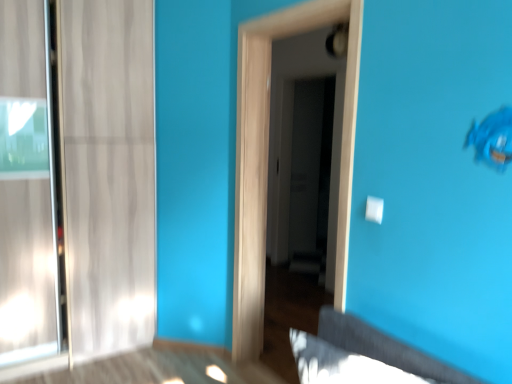
Consider the image. In order to face transparent glass door at center, positioned as the 2th screen door in front-to-back order, should I rotate leftwards or rightwards?

Rotate your view right by about 6.847°.

The image size is (512, 384). What are the coordinates of `transparent glass door at center, which is counted as the 1th screen door, starting from the back` in the screenshot? It's located at (311, 174).

The height and width of the screenshot is (384, 512). Describe the element at coordinates (311, 174) in the screenshot. I see `transparent glass door at center, positioned as the 2th screen door in front-to-back order` at that location.

Image resolution: width=512 pixels, height=384 pixels. Describe the element at coordinates (267, 158) in the screenshot. I see `transparent glass door at center, which is the 1th screen door from front to back` at that location.

In order to click on transparent glass door at center, the second screen door positioned from the back in this screenshot , I will do `click(267, 158)`.

Identify the location of transparent glass door at center, positioned as the 2th screen door in front-to-back order. pyautogui.click(x=311, y=174).

Is transparent glass door at center, the second screen door positioned from the back, at the left side of transparent glass door at center, which is counted as the 1th screen door, starting from the back?

Yes, transparent glass door at center, the second screen door positioned from the back, is to the left of transparent glass door at center, which is counted as the 1th screen door, starting from the back.

Is the depth of transparent glass door at center, the second screen door positioned from the back, less than that of transparent glass door at center, positioned as the 2th screen door in front-to-back order?

Yes.

Which point is more forward, (348, 107) or (302, 247)?

Point (348, 107)

From the image's perspective, is transparent glass door at center, the second screen door positioned from the back, positioned above or below transparent glass door at center, which is counted as the 1th screen door, starting from the back?

Clearly, from the image's perspective, transparent glass door at center, the second screen door positioned from the back, is below transparent glass door at center, which is counted as the 1th screen door, starting from the back.

From a real-world perspective, is transparent glass door at center, which is the 1th screen door from front to back, located beneath transparent glass door at center, which is counted as the 1th screen door, starting from the back?

Yes, from a real-world perspective, transparent glass door at center, which is the 1th screen door from front to back, is beneath transparent glass door at center, which is counted as the 1th screen door, starting from the back.

Which of these two, transparent glass door at center, which is the 1th screen door from front to back, or transparent glass door at center, which is counted as the 1th screen door, starting from the back, is wider?

transparent glass door at center, which is the 1th screen door from front to back, is wider.

Looking at this image, considering the sizes of objects transparent glass door at center, which is the 1th screen door from front to back, and transparent glass door at center, positioned as the 2th screen door in front-to-back order, in the image provided, who is shorter, transparent glass door at center, which is the 1th screen door from front to back, or transparent glass door at center, positioned as the 2th screen door in front-to-back order,?

transparent glass door at center, positioned as the 2th screen door in front-to-back order.

From the picture: Considering the sizes of transparent glass door at center, the second screen door positioned from the back, and transparent glass door at center, positioned as the 2th screen door in front-to-back order, in the image, is transparent glass door at center, the second screen door positioned from the back, bigger or smaller than transparent glass door at center, positioned as the 2th screen door in front-to-back order,?

transparent glass door at center, the second screen door positioned from the back, is bigger than transparent glass door at center, positioned as the 2th screen door in front-to-back order.

From the picture: Which is correct: transparent glass door at center, the second screen door positioned from the back, is inside transparent glass door at center, which is counted as the 1th screen door, starting from the back, or outside of it?

transparent glass door at center, the second screen door positioned from the back, is located beyond the bounds of transparent glass door at center, which is counted as the 1th screen door, starting from the back.

Is transparent glass door at center, which is the 1th screen door from front to back, next to transparent glass door at center, positioned as the 2th screen door in front-to-back order?

No, transparent glass door at center, which is the 1th screen door from front to back, is not in contact with transparent glass door at center, positioned as the 2th screen door in front-to-back order.

Is transparent glass door at center, which is counted as the 1th screen door, starting from the back, at the back of transparent glass door at center, the second screen door positioned from the back?

That's not correct — transparent glass door at center, the second screen door positioned from the back, is not looking away from transparent glass door at center, which is counted as the 1th screen door, starting from the back.

The height and width of the screenshot is (384, 512). Find the location of `screen door on the right side of transparent glass door at center, the second screen door positioned from the back`. screen door on the right side of transparent glass door at center, the second screen door positioned from the back is located at coordinates (311, 174).

Is transparent glass door at center, which is counted as the 1th screen door, starting from the back, to the left or to the right of transparent glass door at center, the second screen door positioned from the back, in the image?

Based on their positions, transparent glass door at center, which is counted as the 1th screen door, starting from the back, is located to the right of transparent glass door at center, the second screen door positioned from the back.

Between transparent glass door at center, which is counted as the 1th screen door, starting from the back, and transparent glass door at center, which is the 1th screen door from front to back, which one is positioned in front?

Positioned in front is transparent glass door at center, which is the 1th screen door from front to back.

Between point (321, 155) and point (347, 159), which one is positioned in front?

The point (347, 159) is more forward.

From the image's perspective, is transparent glass door at center, positioned as the 2th screen door in front-to-back order, located above transparent glass door at center, which is the 1th screen door from front to back?

Yes, from the image's perspective, transparent glass door at center, positioned as the 2th screen door in front-to-back order, is over transparent glass door at center, which is the 1th screen door from front to back.

From a real-world perspective, between transparent glass door at center, positioned as the 2th screen door in front-to-back order, and transparent glass door at center, the second screen door positioned from the back, who is vertically higher?

transparent glass door at center, positioned as the 2th screen door in front-to-back order, is physically above.

Considering the sizes of transparent glass door at center, which is counted as the 1th screen door, starting from the back, and transparent glass door at center, which is the 1th screen door from front to back, in the image, is transparent glass door at center, which is counted as the 1th screen door, starting from the back, wider or thinner than transparent glass door at center, which is the 1th screen door from front to back,?

In the image, transparent glass door at center, which is counted as the 1th screen door, starting from the back, appears to be more narrow than transparent glass door at center, which is the 1th screen door from front to back.

Considering the relative sizes of transparent glass door at center, positioned as the 2th screen door in front-to-back order, and transparent glass door at center, which is the 1th screen door from front to back, in the image provided, is transparent glass door at center, positioned as the 2th screen door in front-to-back order, shorter than transparent glass door at center, which is the 1th screen door from front to back,?

Yes, transparent glass door at center, positioned as the 2th screen door in front-to-back order, is shorter than transparent glass door at center, which is the 1th screen door from front to back.

Looking at this image, does transparent glass door at center, which is counted as the 1th screen door, starting from the back, have a larger size compared to transparent glass door at center, which is the 1th screen door from front to back?

Actually, transparent glass door at center, which is counted as the 1th screen door, starting from the back, might be smaller than transparent glass door at center, which is the 1th screen door from front to back.

Is transparent glass door at center, the second screen door positioned from the back, located within transparent glass door at center, positioned as the 2th screen door in front-to-back order?

That's incorrect, transparent glass door at center, the second screen door positioned from the back, is not inside transparent glass door at center, positioned as the 2th screen door in front-to-back order.

Is transparent glass door at center, positioned as the 2th screen door in front-to-back order, with transparent glass door at center, which is the 1th screen door from front to back?

No, transparent glass door at center, positioned as the 2th screen door in front-to-back order, is not next to transparent glass door at center, which is the 1th screen door from front to back.

Is transparent glass door at center, positioned as the 2th screen door in front-to-back order, looking in the opposite direction of transparent glass door at center, which is the 1th screen door from front to back?

No, transparent glass door at center, positioned as the 2th screen door in front-to-back order, is not facing away from transparent glass door at center, which is the 1th screen door from front to back.

How distant is transparent glass door at center, positioned as the 2th screen door in front-to-back order, from transparent glass door at center, the second screen door positioned from the back?

A distance of 6.35 feet exists between transparent glass door at center, positioned as the 2th screen door in front-to-back order, and transparent glass door at center, the second screen door positioned from the back.

Where is `screen door above the transparent glass door at center, the second screen door positioned from the back (from a real-world perspective)`? screen door above the transparent glass door at center, the second screen door positioned from the back (from a real-world perspective) is located at coordinates (311, 174).

At what (x,y) coordinates should I click in order to perform the action: click on screen door on the right of transparent glass door at center, which is the 1th screen door from front to back. Please return your answer as a coordinate pair (x, y). Looking at the image, I should click on (311, 174).

Image resolution: width=512 pixels, height=384 pixels. In order to click on screen door above the transparent glass door at center, which is the 1th screen door from front to back (from the image's perspective) in this screenshot , I will do `click(311, 174)`.